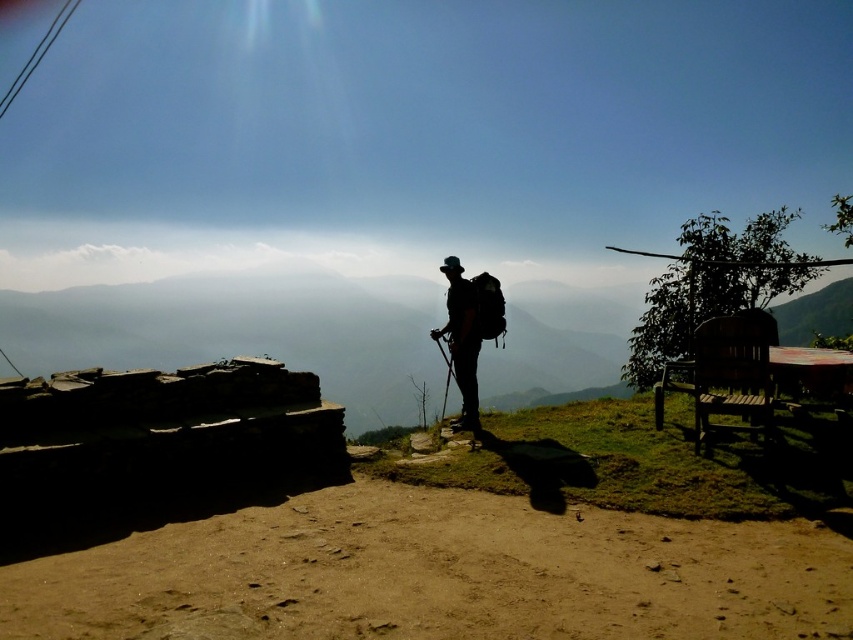
Question: Considering the relative positions of silhouette backpack at center and smooth black ski pole at center in the image provided, where is silhouette backpack at center located with respect to smooth black ski pole at center?

Choices:
 (A) left
 (B) right

Answer: (B)

Question: Does silhouette backpack at center have a smaller size compared to smooth black ski pole at center?

Choices:
 (A) yes
 (B) no

Answer: (B)

Question: Which object is farther from the camera taking this photo?

Choices:
 (A) smooth black ski pole at center
 (B) silhouette backpack at center

Answer: (A)

Question: Which point is closer to the camera?

Choices:
 (A) (444, 352)
 (B) (450, 282)

Answer: (B)

Question: Can you confirm if silhouette backpack at center is wider than smooth black ski pole at center?

Choices:
 (A) yes
 (B) no

Answer: (A)